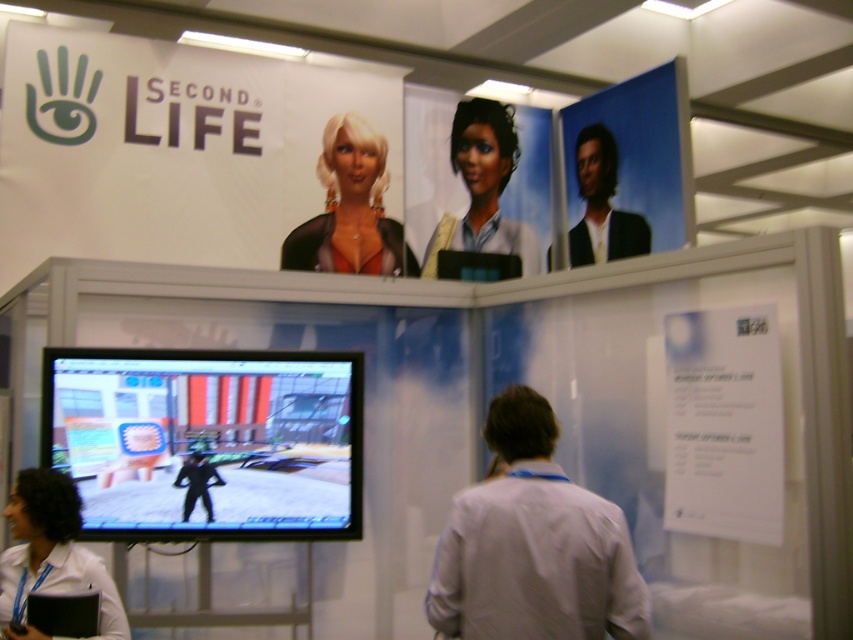
Who is lower down, satin black doll at center or white shirt at lower left?

white shirt at lower left is below.

Does satin black doll at center appear over white shirt at lower left?

Correct, satin black doll at center is located above white shirt at lower left.

Is point (338, 176) less distant than point (90, 572)?

No, (338, 176) is further to viewer.

This screenshot has width=853, height=640. Identify the location of satin black doll at center. (350, 209).

Who is positioned more to the left, white paper at upper center or shiny black hair at upper right?

Positioned to the left is shiny black hair at upper right.

Does white paper at upper center appear over shiny black hair at upper right?

No, white paper at upper center is not above shiny black hair at upper right.

Where is `white paper at upper center`? Image resolution: width=853 pixels, height=640 pixels. white paper at upper center is located at coordinates (723, 424).

Does matte blue shirt at center have a larger size compared to shiny black hair at upper right?

Yes.

Which of these two, matte blue shirt at center or shiny black hair at upper right, stands shorter?

With less height is shiny black hair at upper right.

Where is `matte blue shirt at center`? matte blue shirt at center is located at coordinates (483, 188).